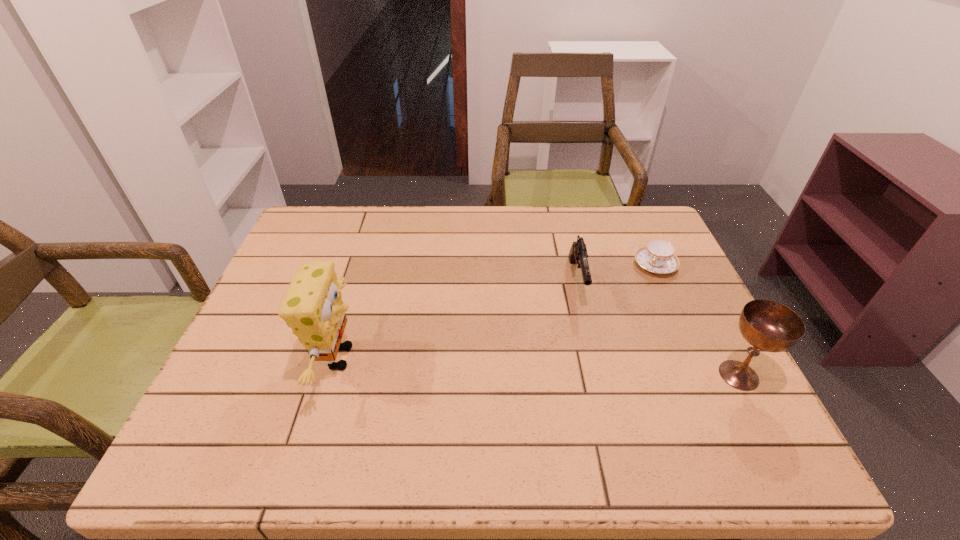
You are a GUI agent. You are given a task and a screenshot of the screen. Output one action in this format:
    pyautogui.click(x=<x>, y=<y>)
    Task: Click on the free space located 0.230m at the end of the barrel of the third object from right to left
    The image size is (960, 540).
    Given the screenshot: What is the action you would take?
    pyautogui.click(x=598, y=387)

Identify the location of free space located on the side with the handle of the teacup. The height and width of the screenshot is (540, 960). (591, 364).

In order to click on free spot located on the side with the handle of the teacup in this screenshot , I will do `click(621, 319)`.

At what (x,y) coordinates should I click in order to perform the action: click on free space located on the side with the handle of the teacup. Please return your answer as a coordinate pair (x, y). The image size is (960, 540). Looking at the image, I should click on (638, 291).

Locate an element on the screen. The image size is (960, 540). object located at the far edge is located at coordinates (658, 256).

This screenshot has height=540, width=960. I want to click on sponge that is at the near edge, so click(x=313, y=307).

What are the coordinates of `chalice positioned at the near edge` in the screenshot? It's located at tap(767, 325).

The height and width of the screenshot is (540, 960). What are the coordinates of `chalice located at the right edge` in the screenshot? It's located at (767, 325).

The width and height of the screenshot is (960, 540). I want to click on teacup that is positioned at the right edge, so click(x=658, y=256).

Identify the location of object that is positioned at the far right corner. (658, 256).